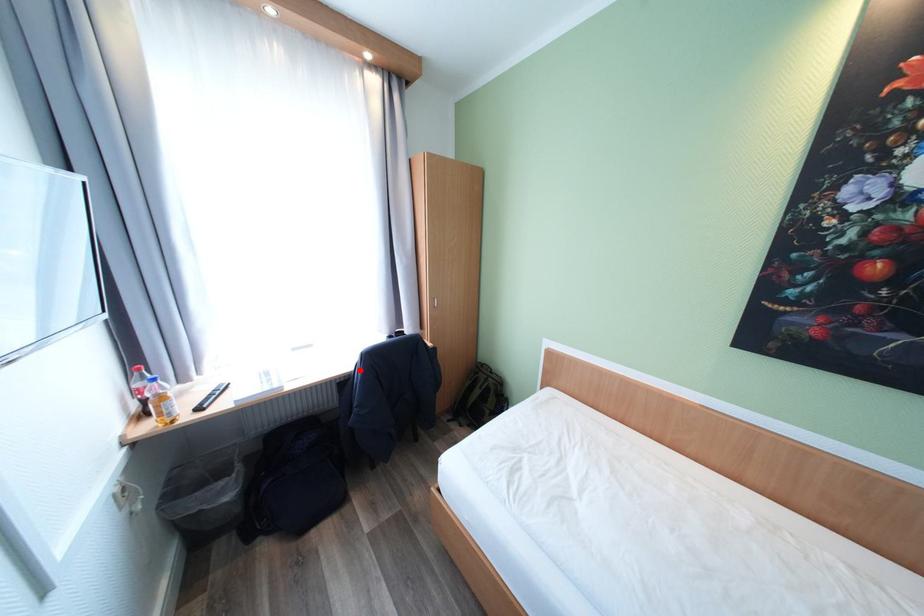
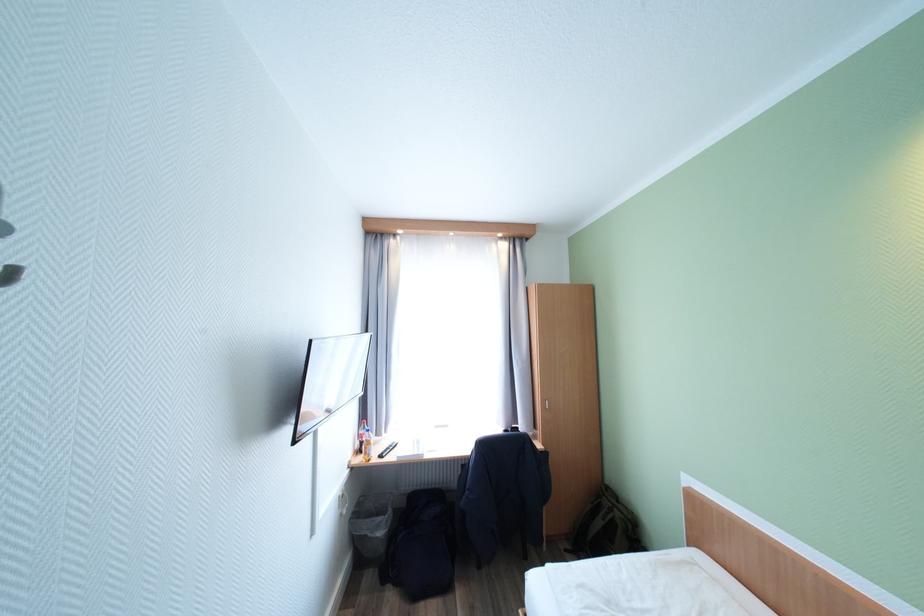
Find the pixel in the second image that matches the highlighted location in the first image.

(477, 455)